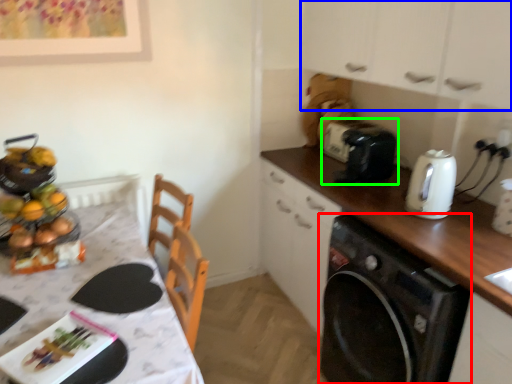
Question: Which is nearer to the home appliance (highlighted by a red box)? cabinetry (highlighted by a blue box) or toaster (highlighted by a green box).

Choices:
 (A) cabinetry
 (B) toaster

Answer: (B)